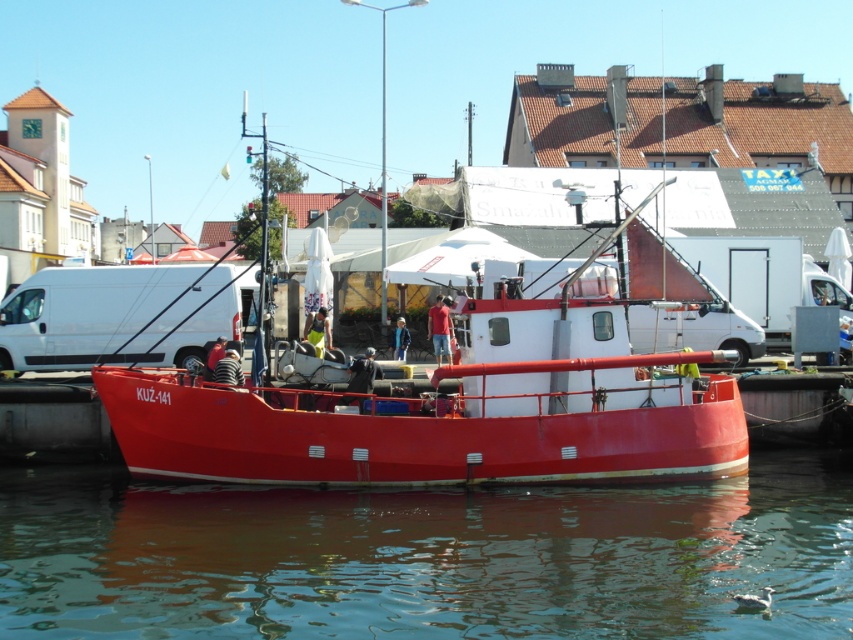
Which of these two, metallic red boat at center or white matte van at center, stands shorter?

white matte van at center is shorter.

Is metallic red boat at center smaller than white matte van at center?

No.

At what (x,y) coordinates should I click in order to perform the action: click on metallic red boat at center. Please return your answer as a coordinate pair (x, y). This screenshot has width=853, height=640. Looking at the image, I should click on (451, 410).

Which is more to the right, transparent water at lower center or metallic red boat at center?

From the viewer's perspective, metallic red boat at center appears more on the right side.

Is transparent water at lower center to the left of metallic red boat at center from the viewer's perspective?

Yes, transparent water at lower center is to the left of metallic red boat at center.

Does point (77, 538) come in front of point (642, 200)?

Yes, point (77, 538) is closer to viewer.

You are a GUI agent. You are given a task and a screenshot of the screen. Output one action in this format:
    pyautogui.click(x=<x>, y=<y>)
    Task: Click on the transparent water at lower center
    Image resolution: width=853 pixels, height=640 pixels.
    Given the screenshot: What is the action you would take?
    pyautogui.click(x=427, y=557)

Who is higher up, transparent water at lower center or white matte van at center?

Positioned higher is white matte van at center.

Is transparent water at lower center positioned at the back of white matte van at center?

No, transparent water at lower center is closer to the viewer.

Between point (605, 547) and point (204, 340), which one is positioned behind?

Positioned behind is point (204, 340).

At what (x,y) coordinates should I click in order to perform the action: click on transparent water at lower center. Please return your answer as a coordinate pair (x, y). Looking at the image, I should click on (427, 557).